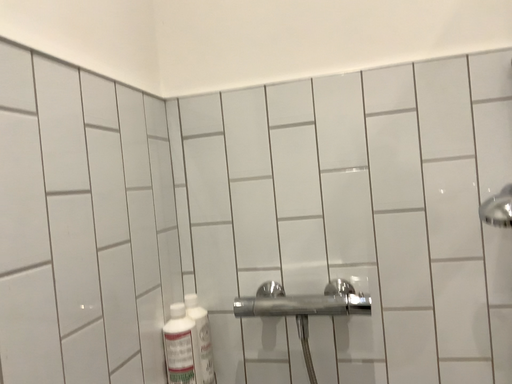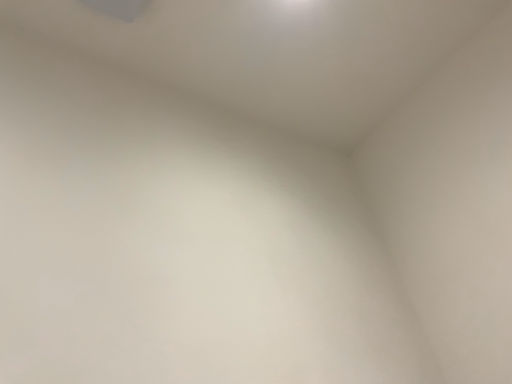
Question: Which way did the camera rotate in the video?

Choices:
 (A) rotated left
 (B) rotated right

Answer: (A)